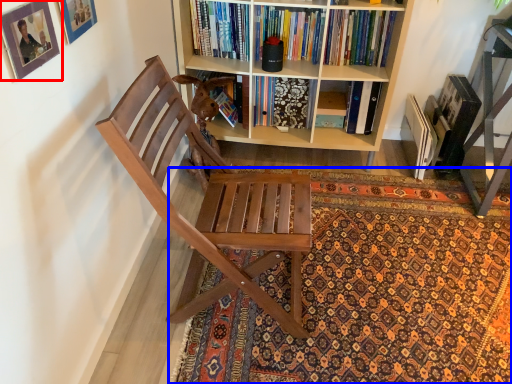
Question: Which point is further to the camera, picture frame (highlighted by a red box) or mat (highlighted by a blue box)?

Choices:
 (A) picture frame
 (B) mat

Answer: (B)